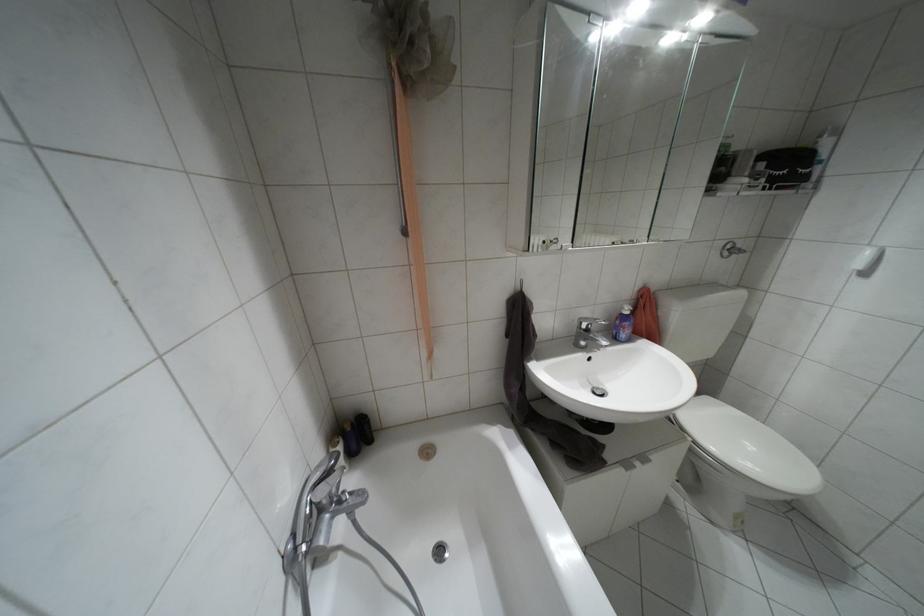
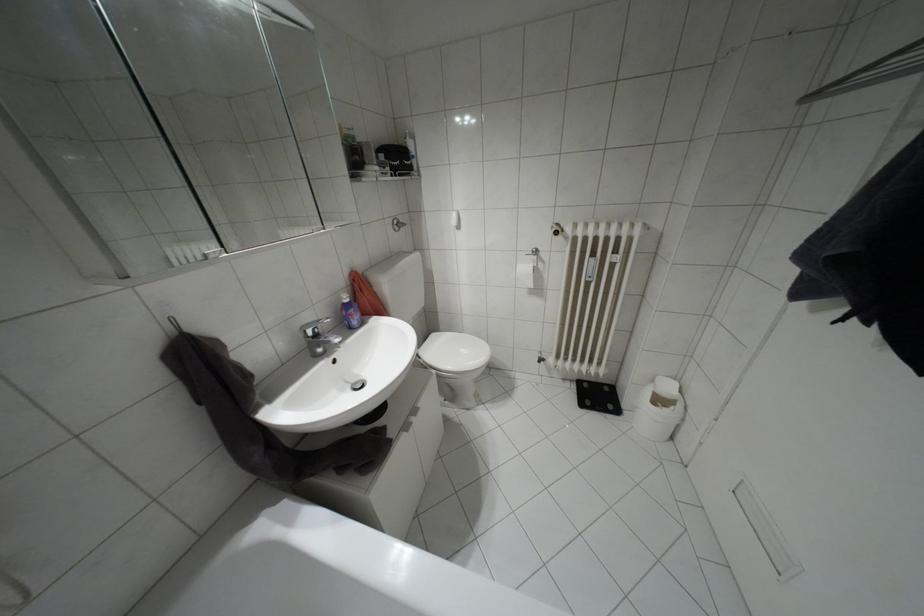
Question: How did the camera likely rotate?

Choices:
 (A) Left
 (B) Right
 (C) Up
 (D) Down

Answer: (B)